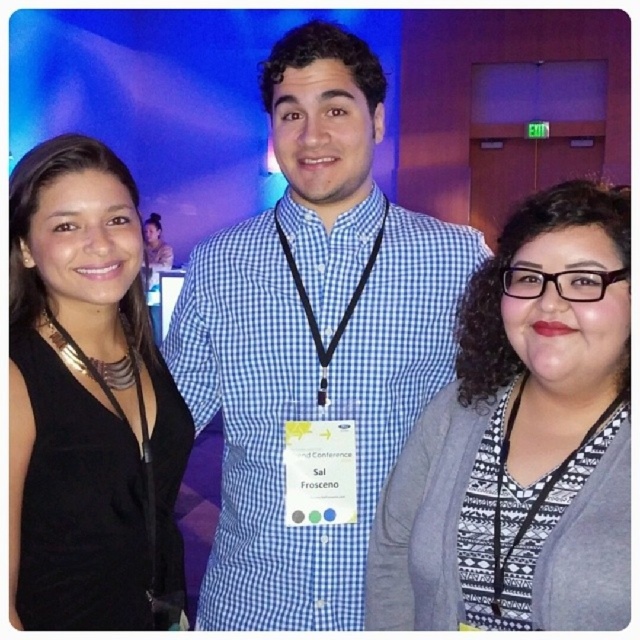
You are a GUI agent. You are given a task and a screenshot of the screen. Output one action in this format:
    pyautogui.click(x=<x>, y=<y>)
    Task: Click on the black matte dress at left
    
    Given the screenshot: What is the action you would take?
    pyautogui.click(x=86, y=401)

Is point (38, 561) positioned after point (145, 458)?

No, it is in front of (145, 458).

You are a GUI agent. You are given a task and a screenshot of the screen. Output one action in this format:
    pyautogui.click(x=<x>, y=<y>)
    Task: Click on the black matte dress at left
    
    Given the screenshot: What is the action you would take?
    pyautogui.click(x=86, y=401)

Can you confirm if black matte dress at left is shorter than black fabric lanyard at lower right?

No.

Is black matte dress at left smaller than black fabric lanyard at lower right?

Actually, black matte dress at left might be larger than black fabric lanyard at lower right.

Which is behind, point (65, 483) or point (548, 484)?

Positioned behind is point (65, 483).

Where is `black matte dress at left`? black matte dress at left is located at coordinates (86, 401).

Between patterned fabric sweater at center and black fabric lanyard at lower right, which one appears on the right side from the viewer's perspective?

From the viewer's perspective, black fabric lanyard at lower right appears more on the right side.

Which is in front, point (596, 307) or point (564, 460)?

Positioned in front is point (596, 307).

Where is `patterned fabric sweater at center`? The image size is (640, 640). patterned fabric sweater at center is located at coordinates (504, 406).